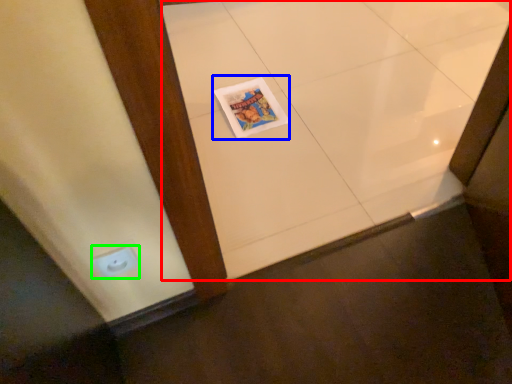
Question: Based on their relative distances, which object is nearer to ceramic tile (highlighted by a red box)? Choose from magazine (highlighted by a blue box) and electric outlet (highlighted by a green box).

Choices:
 (A) magazine
 (B) electric outlet

Answer: (A)